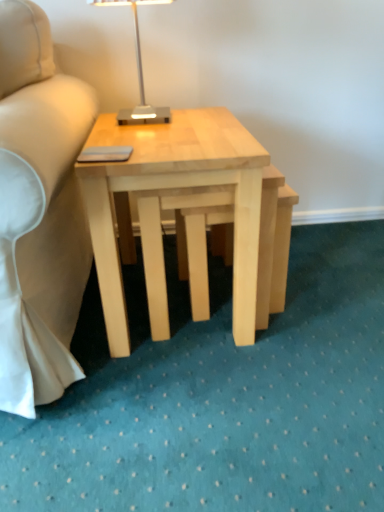
Where is `free location above natural wood coffee table at center (from a real-world perspective)`? The width and height of the screenshot is (384, 512). free location above natural wood coffee table at center (from a real-world perspective) is located at coordinates (173, 129).